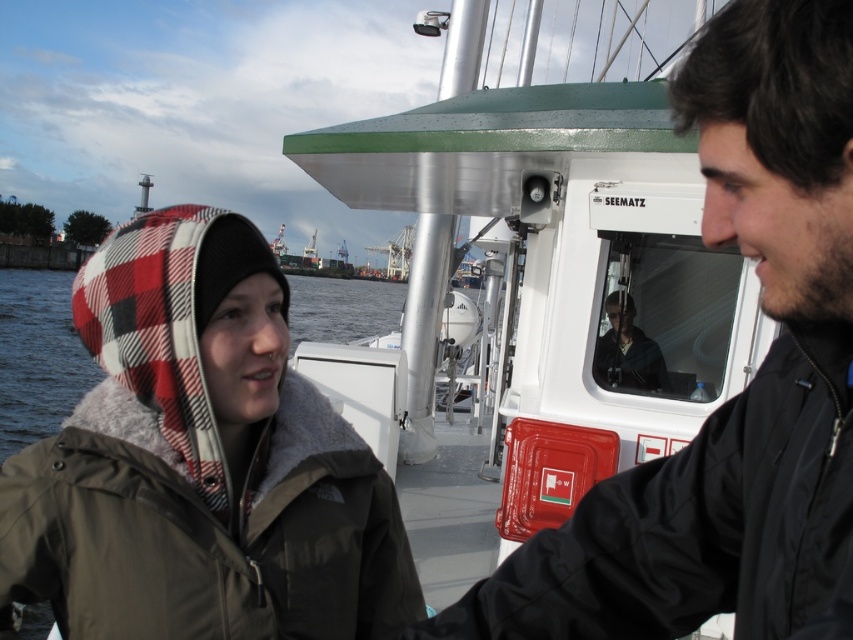
Measure the distance between point (61, 285) and camera.

Point (61, 285) and camera are 70.12 meters apart.

Is point (33, 349) more distant than point (625, 376)?

Yes, point (33, 349) is behind point (625, 376).

Does point (9, 292) come farther from viewer compared to point (637, 381)?

That is True.

Find the location of a particular element. The width and height of the screenshot is (853, 640). plaid fabric water at left is located at coordinates (38, 356).

From the picture: Between black matte jacket at center and matte black jacket at center, which one is positioned higher?

Positioned higher is matte black jacket at center.

Can you confirm if black matte jacket at center is taller than matte black jacket at center?

Yes, black matte jacket at center is taller than matte black jacket at center.

The image size is (853, 640). Describe the element at coordinates (735, 394) in the screenshot. I see `black matte jacket at center` at that location.

Where is `black matte jacket at center`? The height and width of the screenshot is (640, 853). black matte jacket at center is located at coordinates (735, 394).

Who is positioned more to the right, plaid woolen hat at left or black matte jacket at center?

black matte jacket at center is more to the right.

Between point (201, 464) and point (703, 77), which one is positioned behind?

Point (201, 464)

Find the location of a particular element. This screenshot has width=853, height=640. plaid woolen hat at left is located at coordinates (200, 461).